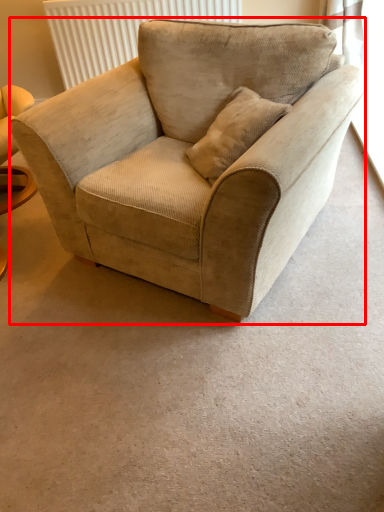
Question: Considering the relative positions of chair (annotated by the red box) and radiator in the image provided, where is chair (annotated by the red box) located with respect to the staircase?

Choices:
 (A) left
 (B) right

Answer: (B)